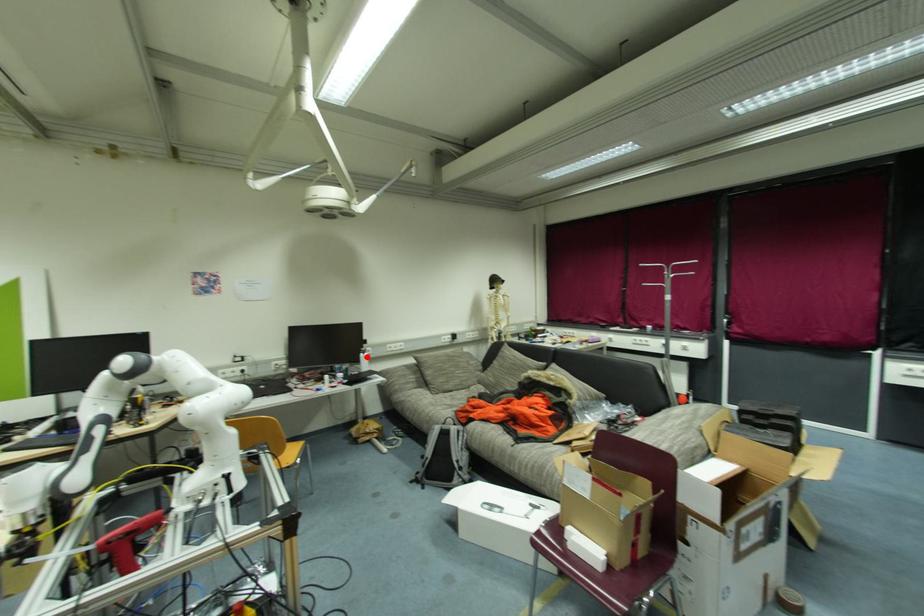
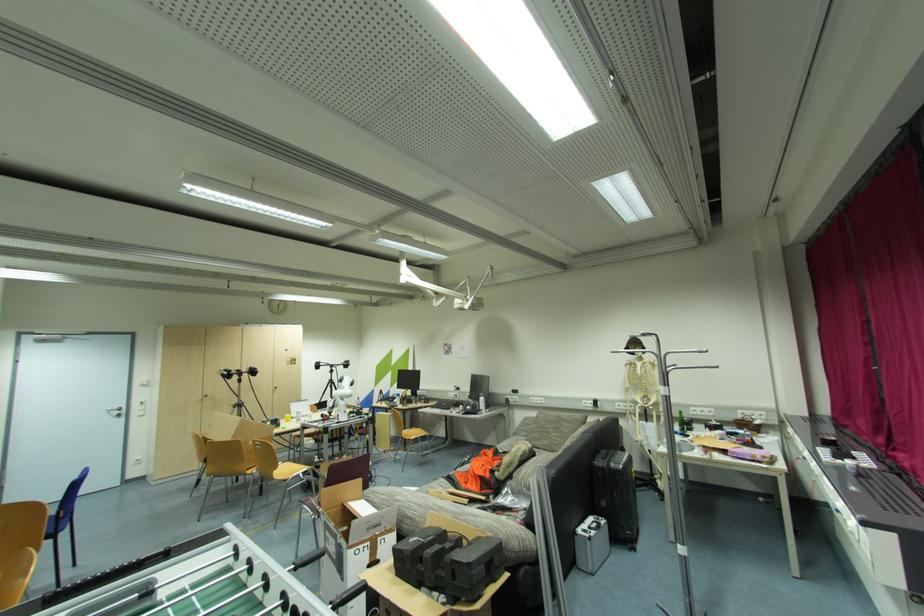
Question: I am providing you with two images of the same scene from different viewpoints. In image1, a red point is highlighted. Considering the same 3D point in image2, which of the following is correct?

Choices:
 (A) It is closer
 (B) It is farther

Answer: (B)